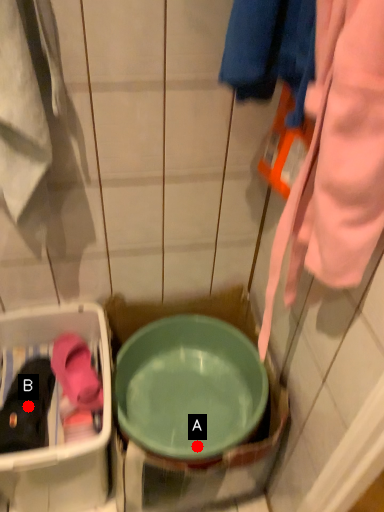
Question: Two points are circled on the image, labeled by A and B beside each circle. Which point is closer to the camera taking this photo?

Choices:
 (A) A is closer
 (B) B is closer

Answer: (B)